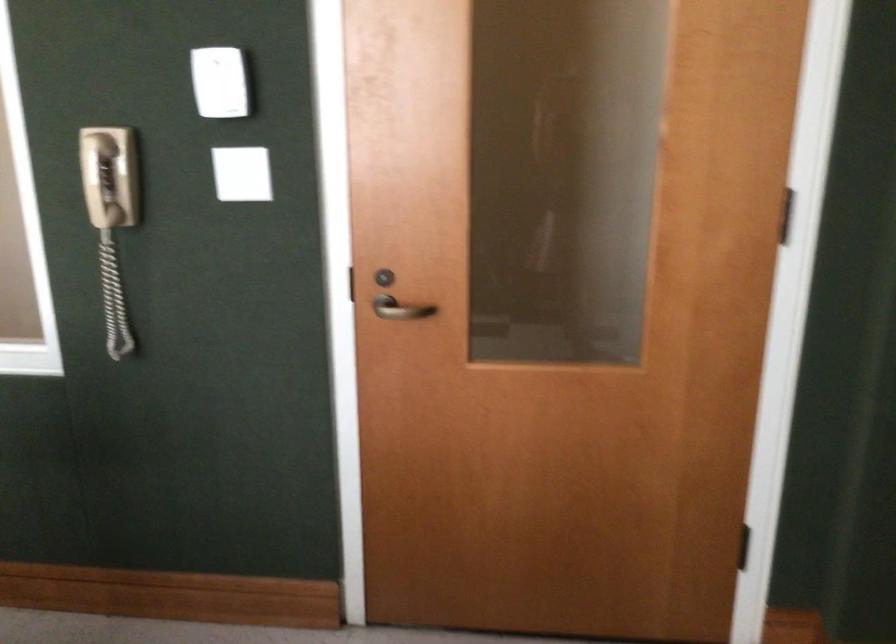
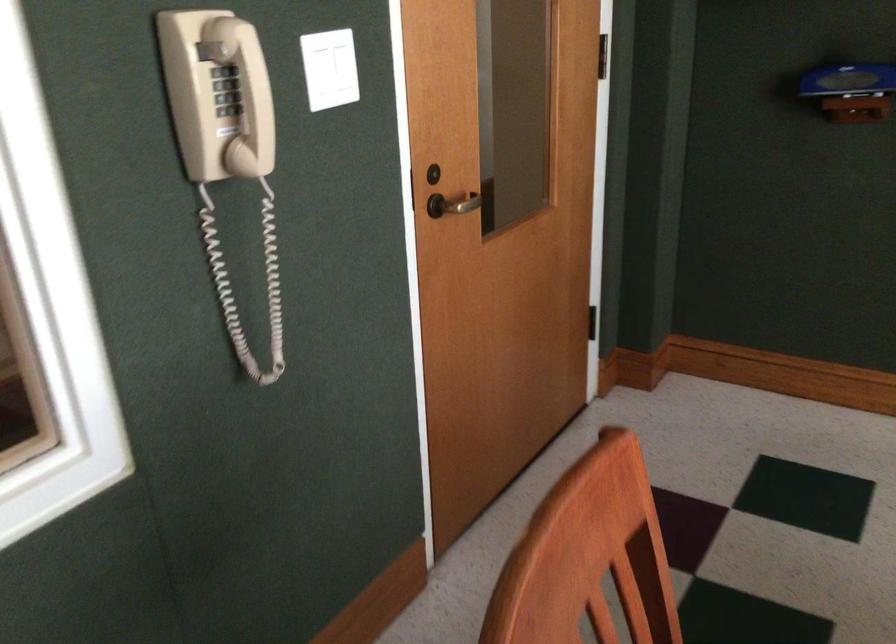
Where in the second image is the point corresponding to [349,290] from the first image?

(409, 191)